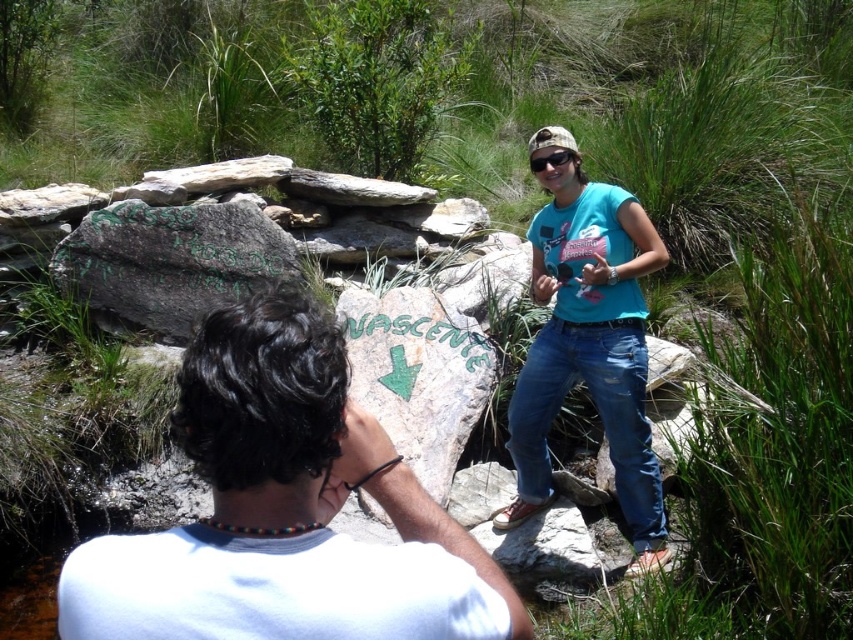
What do you see at coordinates (285, 509) in the screenshot?
I see `white matte shirt at center` at bounding box center [285, 509].

Find the location of a particular element. Image resolution: width=853 pixels, height=640 pixels. white matte shirt at center is located at coordinates pos(285,509).

Who is positioned more to the left, blue cotton t-shirt at center or matte black goggles at upper center?

matte black goggles at upper center is more to the left.

Can you confirm if blue cotton t-shirt at center is shorter than matte black goggles at upper center?

In fact, blue cotton t-shirt at center may be taller than matte black goggles at upper center.

Locate an element on the screen. Image resolution: width=853 pixels, height=640 pixels. blue cotton t-shirt at center is located at coordinates [x=589, y=342].

The height and width of the screenshot is (640, 853). Describe the element at coordinates (285, 509) in the screenshot. I see `white matte shirt at center` at that location.

Which is behind, point (155, 566) or point (656, 564)?

The point (656, 564) is more distant.

Image resolution: width=853 pixels, height=640 pixels. What do you see at coordinates (285, 509) in the screenshot?
I see `white matte shirt at center` at bounding box center [285, 509].

You are a GUI agent. You are given a task and a screenshot of the screen. Output one action in this format:
    pyautogui.click(x=<x>, y=<y>)
    Task: Click on the white matte shirt at center
    The height and width of the screenshot is (640, 853).
    Given the screenshot: What is the action you would take?
    pyautogui.click(x=285, y=509)